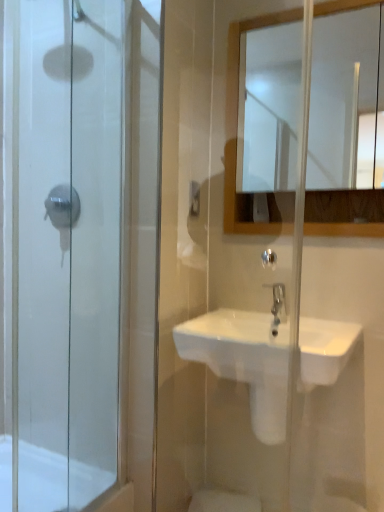
Question: Considering the relative sizes of white glossy mirror at upper center and satin nickel faucet at center in the image provided, is white glossy mirror at upper center bigger than satin nickel faucet at center?

Choices:
 (A) yes
 (B) no

Answer: (A)

Question: Does white glossy mirror at upper center appear on the right side of satin nickel faucet at center?

Choices:
 (A) yes
 (B) no

Answer: (A)

Question: Does white glossy mirror at upper center have a greater height compared to satin nickel faucet at center?

Choices:
 (A) no
 (B) yes

Answer: (B)

Question: Considering the relative sizes of white glossy mirror at upper center and satin nickel faucet at center in the image provided, is white glossy mirror at upper center smaller than satin nickel faucet at center?

Choices:
 (A) yes
 (B) no

Answer: (B)

Question: Is satin nickel faucet at center inside white glossy mirror at upper center?

Choices:
 (A) yes
 (B) no

Answer: (B)

Question: From a real-world perspective, is transparent glass shower door at left positioned above or below satin nickel faucet at center?

Choices:
 (A) above
 (B) below

Answer: (A)

Question: Is transparent glass shower door at left wider or thinner than satin nickel faucet at center?

Choices:
 (A) thin
 (B) wide

Answer: (A)

Question: Is transparent glass shower door at left bigger or smaller than satin nickel faucet at center?

Choices:
 (A) small
 (B) big

Answer: (B)

Question: Which is correct: transparent glass shower door at left is inside satin nickel faucet at center, or outside of it?

Choices:
 (A) inside
 (B) outside

Answer: (B)

Question: Considering the positions of white glossy bath at lower left and transparent glass shower door at left in the image, is white glossy bath at lower left taller or shorter than transparent glass shower door at left?

Choices:
 (A) short
 (B) tall

Answer: (A)

Question: Considering the positions of point (36, 501) and point (134, 145), is point (36, 501) closer or farther from the camera than point (134, 145)?

Choices:
 (A) closer
 (B) farther

Answer: (B)

Question: Looking at their shapes, would you say white glossy bath at lower left is wider or thinner than transparent glass shower door at left?

Choices:
 (A) wide
 (B) thin

Answer: (A)

Question: Is white glossy bath at lower left inside or outside of transparent glass shower door at left?

Choices:
 (A) inside
 (B) outside

Answer: (B)

Question: Visually, is white glossy mirror at upper center positioned to the left or to the right of transparent glass shower door at left?

Choices:
 (A) left
 (B) right

Answer: (B)

Question: Considering the positions of point (281, 137) and point (114, 419), is point (281, 137) closer or farther from the camera than point (114, 419)?

Choices:
 (A) farther
 (B) closer

Answer: (B)